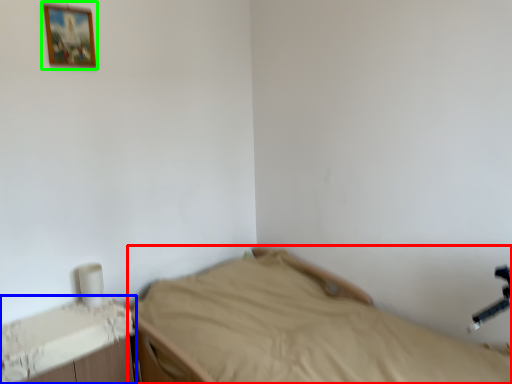
Question: Considering the real-world distances, which object is closest to bed (highlighted by a red box)? changing table (highlighted by a blue box) or picture frame (highlighted by a green box).

Choices:
 (A) changing table
 (B) picture frame

Answer: (A)